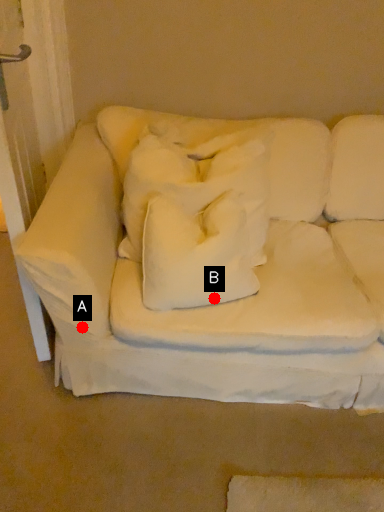
Question: Two points are circled on the image, labeled by A and B beside each circle. Which point is further to the camera?

Choices:
 (A) A is further
 (B) B is further

Answer: (A)